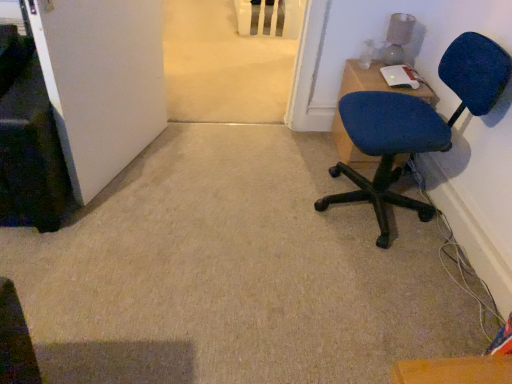
What do you see at coordinates (101, 82) in the screenshot? The width and height of the screenshot is (512, 384). I see `white matte door at lower left` at bounding box center [101, 82].

Locate an element on the screen. The height and width of the screenshot is (384, 512). blue fabric chair at upper right is located at coordinates (377, 82).

Locate an element on the screen. blue fabric chair at right is located at coordinates (415, 124).

Can you confirm if blue fabric chair at right is wider than white matte door at lower left?

Yes, blue fabric chair at right is wider than white matte door at lower left.

Is blue fabric chair at right far from white matte door at lower left?

Indeed, blue fabric chair at right is not near white matte door at lower left.

Is blue fabric chair at right to the left of white matte door at lower left from the viewer's perspective?

No.

Looking at this image, considering their positions, is blue fabric chair at right located in front of or behind white matte door at lower left?

blue fabric chair at right is behind white matte door at lower left.

From a real-world perspective, between blue fabric chair at upper right and white matte door at lower left, who is vertically higher?

From a 3D spatial view, white matte door at lower left is above.

Is blue fabric chair at upper right situated inside white matte door at lower left or outside?

blue fabric chair at upper right is spatially situated outside white matte door at lower left.

Is blue fabric chair at upper right thinner than white matte door at lower left?

Incorrect, the width of blue fabric chair at upper right is not less than that of white matte door at lower left.

Can you confirm if white matte door at lower left is shorter than blue fabric chair at upper right?

Incorrect, the height of white matte door at lower left does not fall short of that of blue fabric chair at upper right.

This screenshot has height=384, width=512. What are the coordinates of `door above the blue fabric chair at upper right (from the image's perspective)` in the screenshot? It's located at (101, 82).

Consider the image. Is white matte door at lower left next to blue fabric chair at upper right and touching it?

There is a gap between white matte door at lower left and blue fabric chair at upper right.

How many degrees apart are the facing directions of white matte door at lower left and blue fabric chair at upper right?

The angular difference between white matte door at lower left and blue fabric chair at upper right is 65.5 degrees.

Is point (374, 137) more distant than point (362, 162)?

That is False.

Consider the image. Does blue fabric chair at right have a larger size compared to blue fabric chair at upper right?

Indeed, blue fabric chair at right has a larger size compared to blue fabric chair at upper right.

Which object is more forward, blue fabric chair at right or blue fabric chair at upper right?

blue fabric chair at right is closer to the camera.

Image resolution: width=512 pixels, height=384 pixels. In order to click on chair in front of the blue fabric chair at upper right in this screenshot , I will do `click(415, 124)`.

Which object is positioned more to the right, blue fabric chair at upper right or blue fabric chair at right?

Positioned to the right is blue fabric chair at upper right.

Can you tell me how much blue fabric chair at upper right and blue fabric chair at right differ in facing direction?

87 degrees separate the facing orientations of blue fabric chair at upper right and blue fabric chair at right.

From the image's perspective, between blue fabric chair at upper right and blue fabric chair at right, who is located below?

blue fabric chair at right appears lower in the image.

Is blue fabric chair at upper right looking in the opposite direction of blue fabric chair at right?

blue fabric chair at upper right does not have its back to blue fabric chair at right.

Considering the relative sizes of white matte door at lower left and blue fabric chair at right in the image provided, is white matte door at lower left taller than blue fabric chair at right?

Yes, white matte door at lower left is taller than blue fabric chair at right.

Is white matte door at lower left bigger than blue fabric chair at right?

Actually, white matte door at lower left might be smaller than blue fabric chair at right.

Is white matte door at lower left next to blue fabric chair at right and touching it?

No, white matte door at lower left is not with blue fabric chair at right.

Which object is wider, white matte door at lower left or blue fabric chair at right?

Wider between the two is blue fabric chair at right.

You are a GUI agent. You are given a task and a screenshot of the screen. Output one action in this format:
    pyautogui.click(x=<x>, y=<y>)
    Task: Click on the chair on the right of the white matte door at lower left
    
    Given the screenshot: What is the action you would take?
    pyautogui.click(x=415, y=124)

Identify the location of desk below the white matte door at lower left (from the image's perspective). This screenshot has height=384, width=512. (377, 82).

Looking at the image, which one is located closer to blue fabric chair at right, blue fabric chair at upper right or white matte door at lower left?

The object closer to blue fabric chair at right is blue fabric chair at upper right.

Estimate the real-world distances between objects in this image. Which object is further from blue fabric chair at upper right, blue fabric chair at right or white matte door at lower left?

The object further to blue fabric chair at upper right is white matte door at lower left.

Looking at the image, which one is located closer to blue fabric chair at upper right, white matte door at lower left or blue fabric chair at right?

Among the two, blue fabric chair at right is located nearer to blue fabric chair at upper right.

Which object lies nearer to the anchor point blue fabric chair at right, white matte door at lower left or blue fabric chair at upper right?

Based on the image, blue fabric chair at upper right appears to be nearer to blue fabric chair at right.

Looking at the image, which one is located closer to white matte door at lower left, blue fabric chair at upper right or blue fabric chair at right?

The object closer to white matte door at lower left is blue fabric chair at upper right.

In the scene shown: Looking at the image, which one is located further to white matte door at lower left, blue fabric chair at right or blue fabric chair at upper right?

The object further to white matte door at lower left is blue fabric chair at right.

You are a GUI agent. You are given a task and a screenshot of the screen. Output one action in this format:
    pyautogui.click(x=<x>, y=<y>)
    Task: Click on the chair situated between white matte door at lower left and blue fabric chair at upper right from left to right
    
    Given the screenshot: What is the action you would take?
    pyautogui.click(x=415, y=124)